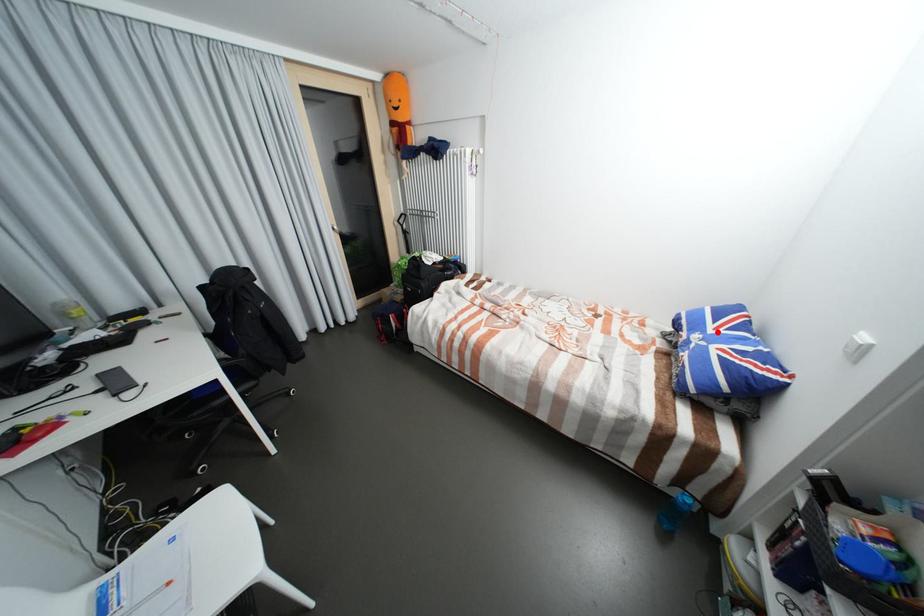
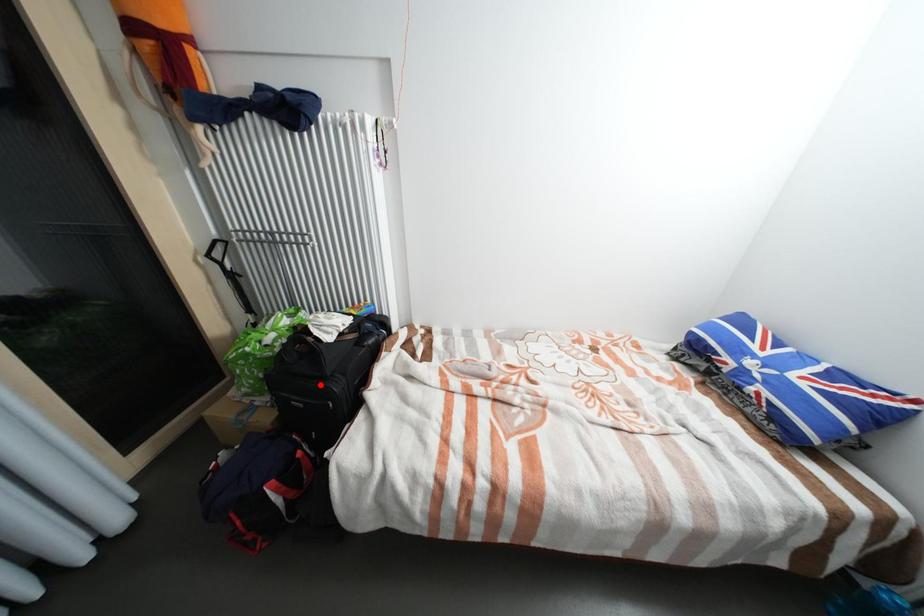
I am providing you with two images of the same scene from different viewpoints. A red point is marked on the first image and another point is marked on the second image. Is the marked point in image1 the same physical position as the marked point in image2?

No